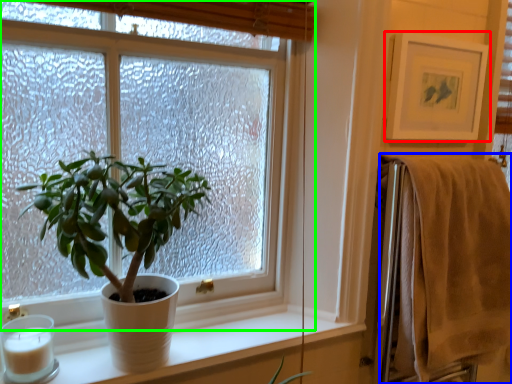
Question: Which object is the closest to the picture frame (highlighted by a red box)? Choose among these: bath towel (highlighted by a blue box) or window (highlighted by a green box).

Choices:
 (A) bath towel
 (B) window

Answer: (A)